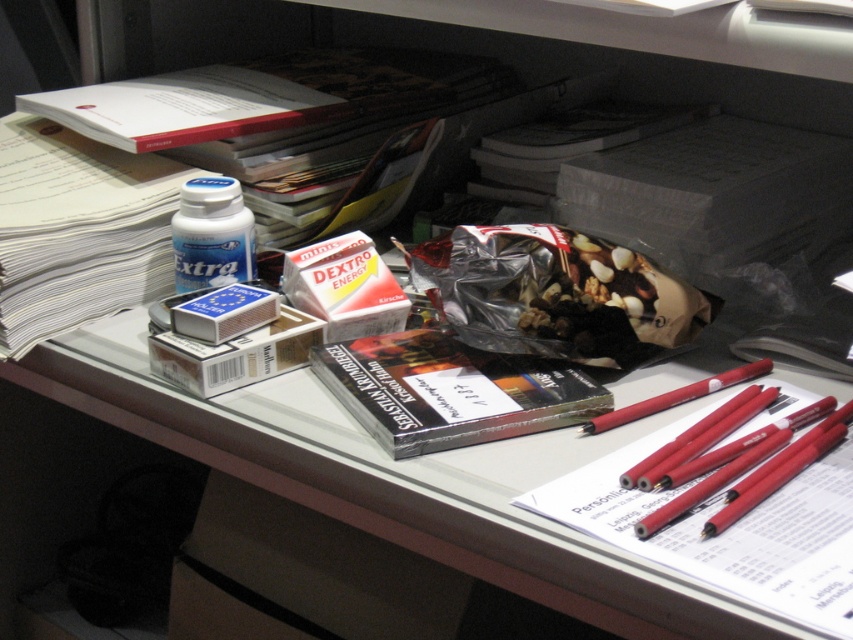
In the scene shown: You are organizing items on the desk and need to place the red matte pencil at right on the matte plastic table at center. Will the pencil fit horizontally on the table?

The matte plastic table at center is wider than the red matte pencil at right, so yes, the pencil will fit horizontally on the matte plastic table at center.

Looking at this image, you are organizing the desk and need to place a new item between the matte plastic table at center and the red matte pencil at right. Based on their positions, where should you place the item?

The matte plastic table at center is located below the red matte pencil at right, so placing the new item between them would require positioning it above the matte plastic table at center and below the red matte pencil at right.

You are organizing the items on the desk. You need to place the white glossy pill bottle at upper left and the red matte pencil at right into a drawer. Which item should you place first if you want to start with the one closer to the edge of the desk?

The red matte pencil at right should be placed first because it is located below the white glossy pill bottle at upper left, meaning it is closer to the edge of the desk.